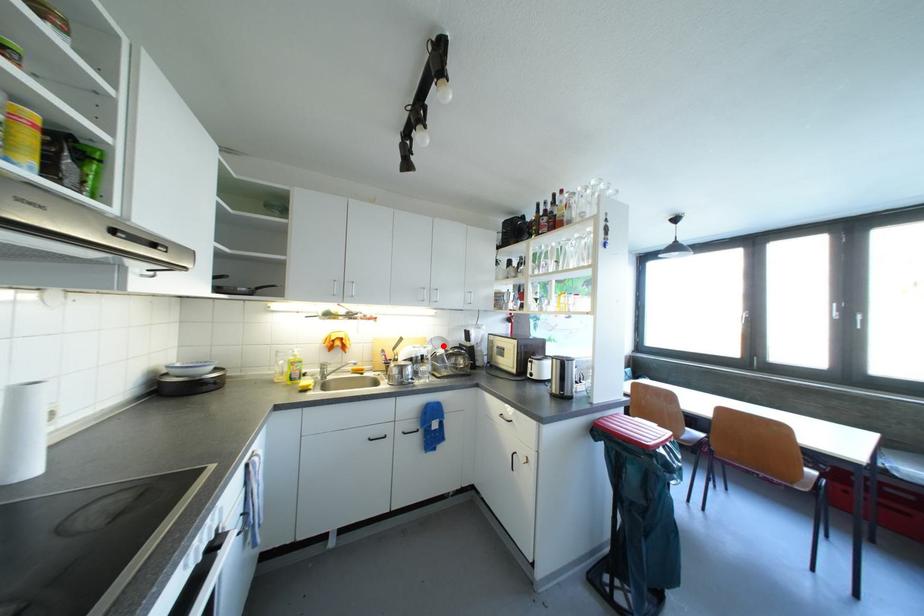
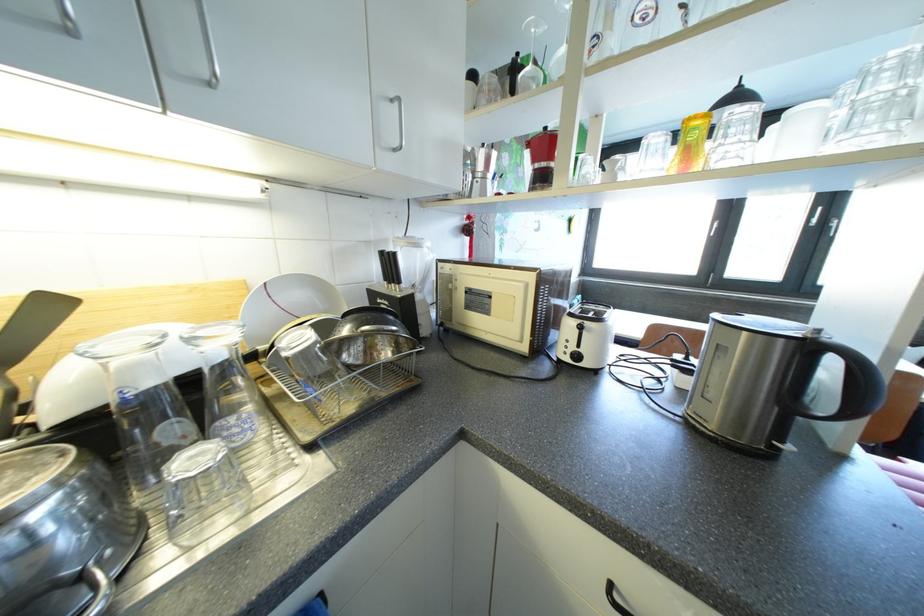
Find the pixel in the second image that matches the highlighted location in the first image.

(300, 299)